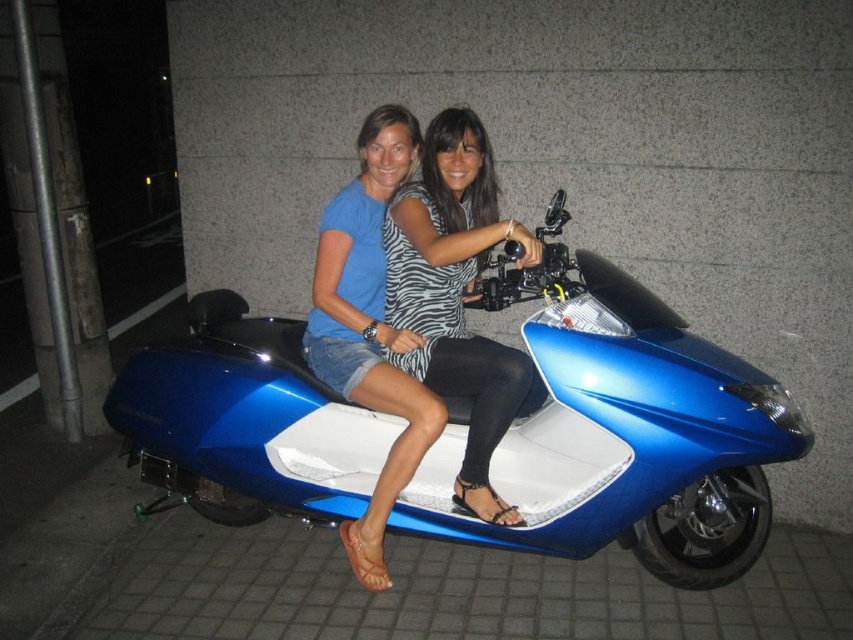
Is blue denim shorts at center thinner than striped fabric dress at center?

In fact, blue denim shorts at center might be wider than striped fabric dress at center.

Is blue denim shorts at center positioned before striped fabric dress at center?

Yes.

Is point (404, 465) positioned behind point (363, 129)?

No.

What are the coordinates of `blue denim shorts at center` in the screenshot? It's located at (369, 324).

Is point (476, 180) positioned behind point (409, 451)?

Yes, it is behind point (409, 451).

Does point (395, 218) come closer to viewer compared to point (316, 285)?

Yes, point (395, 218) is in front of point (316, 285).

Is point (422, 349) positioned after point (401, 460)?

Yes, it is behind point (401, 460).

The width and height of the screenshot is (853, 640). Identify the location of zebra print dress at center. (456, 292).

Looking at this image, which of these two, blue metallic scooter at center or striped fabric dress at center, stands shorter?

striped fabric dress at center is shorter.

Does blue metallic scooter at center lie in front of striped fabric dress at center?

Yes, blue metallic scooter at center is in front of striped fabric dress at center.

Does point (720, 484) come behind point (395, 113)?

No, it is in front of (395, 113).

Find the location of `blue metallic scooter at center`. blue metallic scooter at center is located at coordinates 621,433.